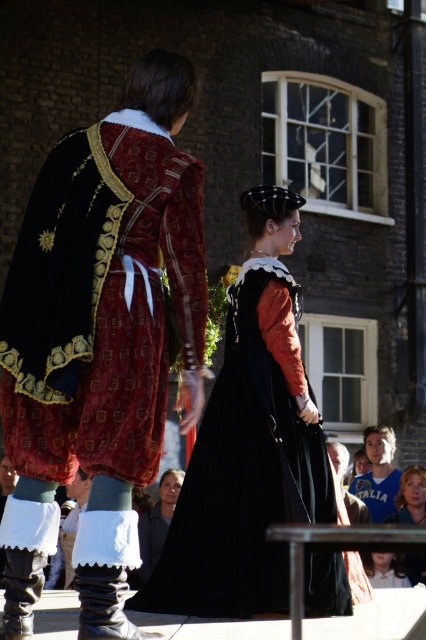
You are a costume designer observing the historical reenactment. You notice two central pieces of clothing, the black satin dress at center and the matte black coat at center. Which one is positioned higher in the image?

The black satin dress at center is above the matte black coat at center, so it is positioned higher in the image.

You are a costume designer observing the historical reenactment scene. You need to place a new accessory exactly at the midpoint between the black satin dress at center and the nearest edge of the image. Which edge of the image should you measure from to ensure the accessory is correctly positioned?

The black satin dress at center is located at point (242, 476). To find the midpoint between it and the nearest edge, calculate the distances to all four edges. The nearest edge would be the right edge since the x coordinate 0.745 is closer to 1.0 than to 0.0. Therefore, measure from the right edge of the image to ensure correct positioning.

You are a photographer trying to capture the best angle of the two historical reenactors. You notice two specific points in the scene marked as point 1 at coordinates point (129, 148) and point 2 at coordinates point (406, 560). Which point is positioned closer to your camera lens?

Point (129, 148) is closer to the viewer than point (406, 560), so the photographer should focus on point 1 for a closer shot.